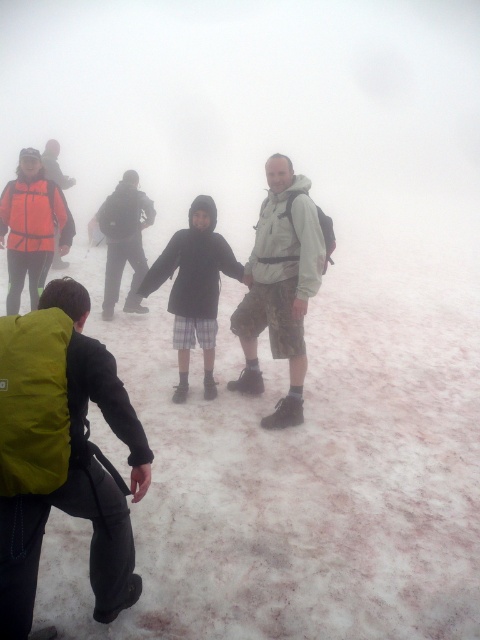
You are a photographer trying to capture the group of people in the snowy landscape. You want to ensure that the green fabric backpack at lower left is in the frame. Based on its position, where should you position your camera relative to the backpack?

The green fabric backpack at lower left is located at coordinates point (68, 468). To include it in the frame, position your camera so that the backpack is placed at that specific coordinate point within the image.

You are a photographer trying to capture a clear shot of the matte black jacket at center and the camouflage shorts at center in the snowy scene. Since the fog is thick, you want to focus on the object that is closer to you. Which object should you focus on?

The camouflage shorts at center is closer to the viewer than matte black jacket at center, so you should focus on the camouflage shorts at center to get a clearer shot in the foggy conditions.